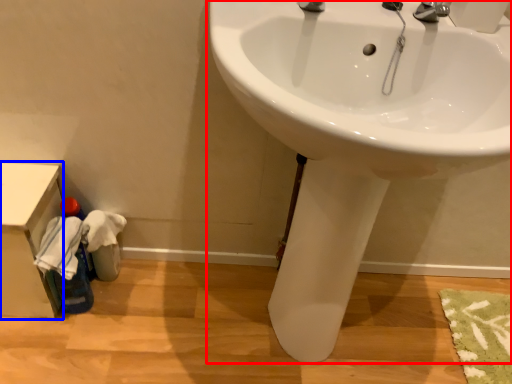
Question: Which point is further to the camera, sink (highlighted by a red box) or counter top (highlighted by a blue box)?

Choices:
 (A) sink
 (B) counter top

Answer: (B)